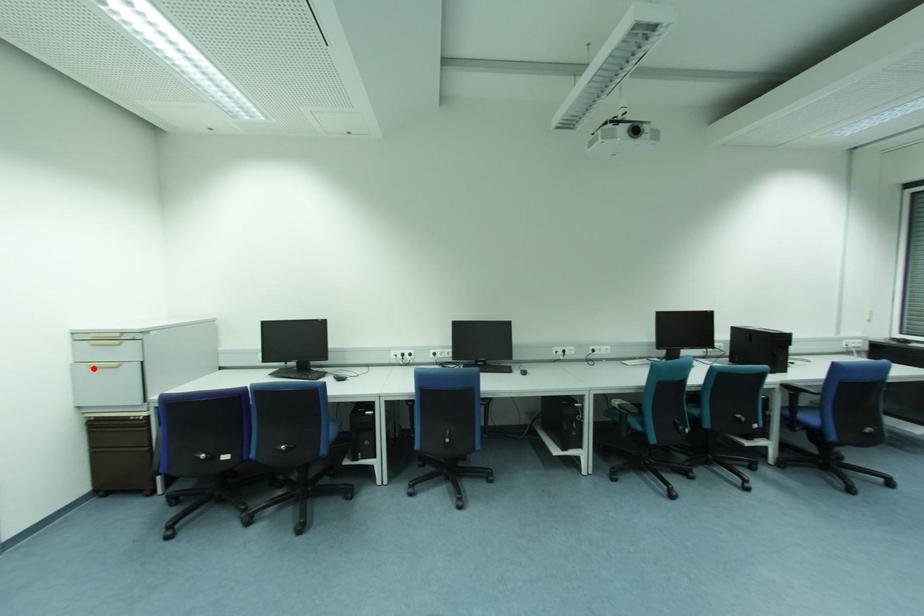
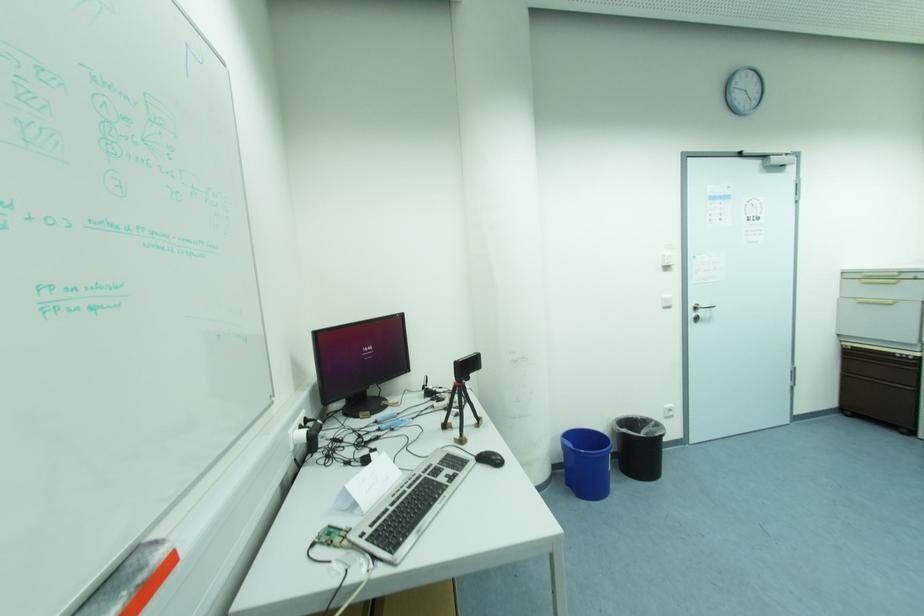
Where in the second image is the point corresponding to the highlighted location from the first image?

(862, 304)